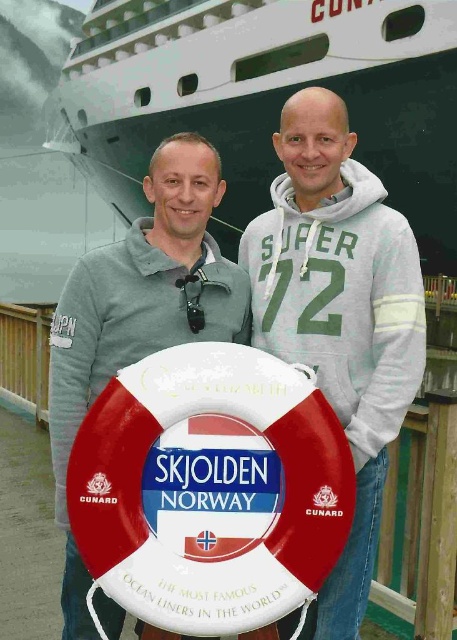
Is white matte life preserver at center to the left of matte gray hoodie at center from the viewer's perspective?

No, white matte life preserver at center is not to the left of matte gray hoodie at center.

Describe the element at coordinates (340, 312) in the screenshot. Image resolution: width=457 pixels, height=640 pixels. I see `white matte life preserver at center` at that location.

This screenshot has width=457, height=640. What are the coordinates of `white matte life preserver at center` in the screenshot? It's located at (340, 312).

How distant is white plastic lifebuoy at center from matte gray hoodie at center?

white plastic lifebuoy at center and matte gray hoodie at center are 3.91 feet apart from each other.

Can you confirm if white plastic lifebuoy at center is wider than matte gray hoodie at center?

In fact, white plastic lifebuoy at center might be narrower than matte gray hoodie at center.

Does point (329, 381) come in front of point (63, 586)?

Yes, it is in front of point (63, 586).

The image size is (457, 640). In order to click on white plastic lifebuoy at center in this screenshot , I will do `click(340, 312)`.

Is point (334, 404) behind point (391, 225)?

No, it is in front of (391, 225).

Who is more distant from viewer, (100, 612) or (338, 112)?

The point (100, 612) is behind.

You are a GUI agent. You are given a task and a screenshot of the screen. Output one action in this format:
    pyautogui.click(x=<x>, y=<y>)
    Task: Click on the white plastic lifebuoy at center
    The width and height of the screenshot is (457, 640).
    Given the screenshot: What is the action you would take?
    pyautogui.click(x=340, y=312)